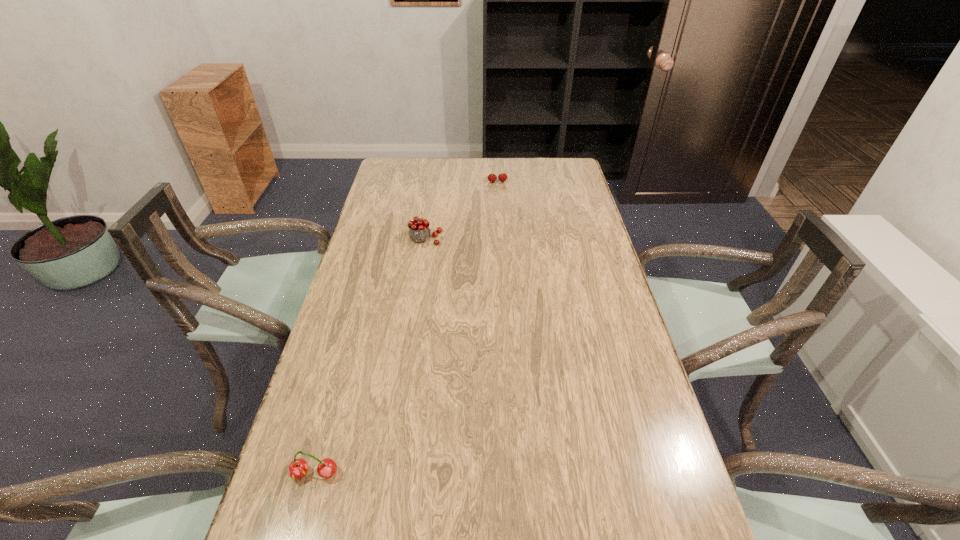
You are a GUI agent. You are given a task and a screenshot of the screen. Output one action in this format:
    pyautogui.click(x=<x>, y=<y>)
    Task: Click on the second cherry from left to right
    This screenshot has width=960, height=540.
    Given the screenshot: What is the action you would take?
    pyautogui.click(x=419, y=231)

The image size is (960, 540). I want to click on the second object from left to right, so (x=419, y=231).

What are the coordinates of `the farthest object` in the screenshot? It's located at point(502,177).

This screenshot has width=960, height=540. Identify the location of the rightmost cherry. (502, 177).

Where is `the leftmost object`? This screenshot has height=540, width=960. the leftmost object is located at coordinates (298, 468).

Where is `the nearest object`? the nearest object is located at coordinates (298, 468).

Where is `vacant point located on the handle side of the second nearest object`? vacant point located on the handle side of the second nearest object is located at coordinates (421, 266).

Locate an element on the screen. This screenshot has width=960, height=540. free space located on the surface of the farthest object is located at coordinates (500, 227).

The image size is (960, 540). Find the location of `vacant space located with stems pointing upwards on the leftmost cherry`. vacant space located with stems pointing upwards on the leftmost cherry is located at coordinates (299, 533).

I want to click on object that is at the far edge, so (x=502, y=177).